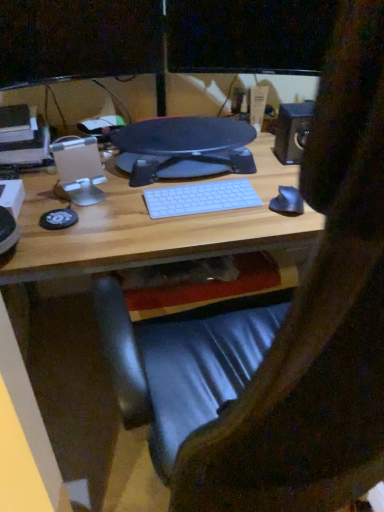
Question: Considering the relative sizes of matte black monitor at upper center, which is the 2th computer monitor from left to right, and matte black monitor at upper center, which appears as the 2th computer monitor when viewed from the right, in the image provided, is matte black monitor at upper center, which is the 2th computer monitor from left to right, bigger than matte black monitor at upper center, which appears as the 2th computer monitor when viewed from the right,?

Choices:
 (A) no
 (B) yes

Answer: (B)

Question: From the image's perspective, would you say matte black monitor at upper center, which is counted as the 1th computer monitor, starting from the right, is positioned over matte black monitor at upper center, which appears as the 2th computer monitor when viewed from the right?

Choices:
 (A) yes
 (B) no

Answer: (A)

Question: Is matte black monitor at upper center, which is counted as the 1th computer monitor, starting from the right, positioned behind matte black monitor at upper center, the 1th computer monitor when ordered from left to right?

Choices:
 (A) no
 (B) yes

Answer: (B)

Question: Is matte black monitor at upper center, which is counted as the 1th computer monitor, starting from the right, closer to camera compared to matte black monitor at upper center, the 1th computer monitor when ordered from left to right?

Choices:
 (A) yes
 (B) no

Answer: (B)

Question: From a real-world perspective, is matte black monitor at upper center, which is counted as the 1th computer monitor, starting from the right, on top of matte black monitor at upper center, the 1th computer monitor when ordered from left to right?

Choices:
 (A) no
 (B) yes

Answer: (B)

Question: In terms of width, does metallic black speaker at upper right look wider or thinner when compared to white matte keyboard at center?

Choices:
 (A) thin
 (B) wide

Answer: (B)

Question: Considering their positions, is metallic black speaker at upper right located in front of or behind white matte keyboard at center?

Choices:
 (A) front
 (B) behind

Answer: (B)

Question: From a real-world perspective, is metallic black speaker at upper right above or below white matte keyboard at center?

Choices:
 (A) below
 (B) above

Answer: (B)

Question: From the image's perspective, is metallic black speaker at upper right positioned above or below white matte keyboard at center?

Choices:
 (A) below
 (B) above

Answer: (B)

Question: Is matte black monitor at upper center, which is the 2th computer monitor from left to right, situated inside metallic black speaker at upper right or outside?

Choices:
 (A) outside
 (B) inside

Answer: (A)

Question: Considering the positions of point (228, 1) and point (302, 136), is point (228, 1) closer or farther from the camera than point (302, 136)?

Choices:
 (A) farther
 (B) closer

Answer: (B)

Question: From a real-world perspective, is matte black monitor at upper center, which is counted as the 1th computer monitor, starting from the right, positioned above or below metallic black speaker at upper right?

Choices:
 (A) above
 (B) below

Answer: (A)

Question: Based on their sizes in the image, would you say matte black monitor at upper center, which is counted as the 1th computer monitor, starting from the right, is bigger or smaller than metallic black speaker at upper right?

Choices:
 (A) big
 (B) small

Answer: (A)

Question: Considering the relative positions of matte black monitor at upper center, which is the 2th computer monitor from left to right, and matte black monitor at upper center, which appears as the 2th computer monitor when viewed from the right, in the image provided, is matte black monitor at upper center, which is the 2th computer monitor from left to right, to the left or to the right of matte black monitor at upper center, which appears as the 2th computer monitor when viewed from the right,?

Choices:
 (A) right
 (B) left

Answer: (A)

Question: From a real-world perspective, is matte black monitor at upper center, which is counted as the 1th computer monitor, starting from the right, physically located above or below matte black monitor at upper center, the 1th computer monitor when ordered from left to right?

Choices:
 (A) below
 (B) above

Answer: (B)